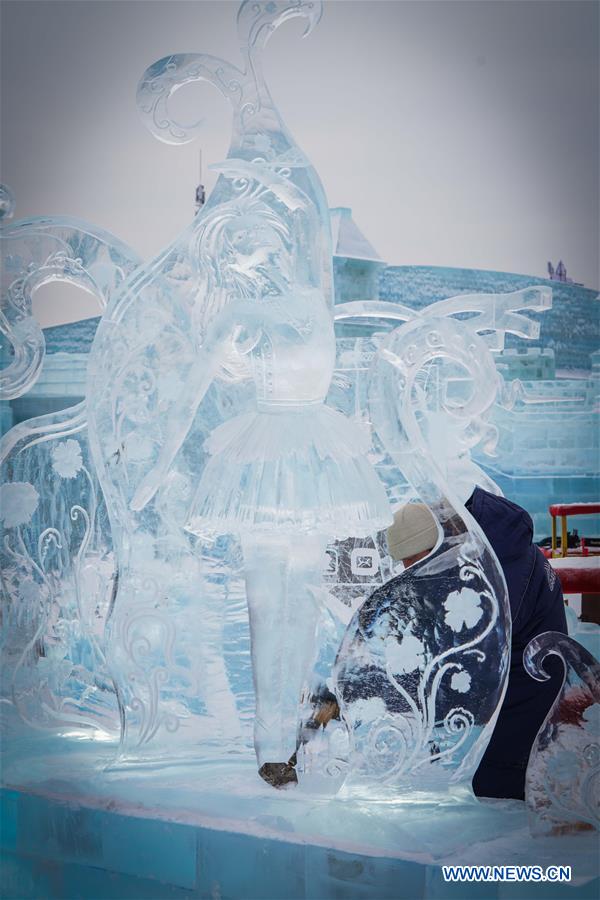
Where is `surface`? surface is located at coordinates 323,816.